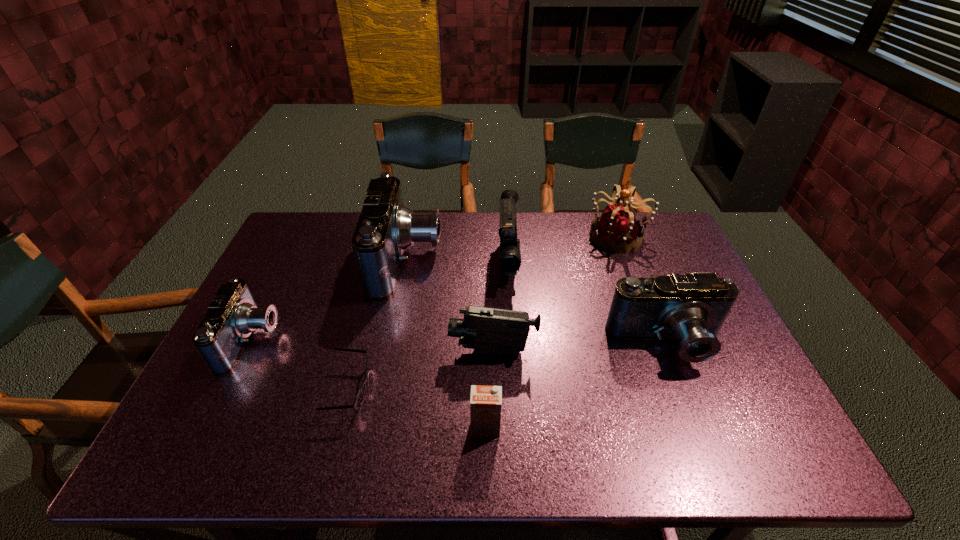
This screenshot has height=540, width=960. I want to click on blue camcorder that is the closest to the bigger black camcorder, so click(385, 228).

Locate an element on the screen. The image size is (960, 540). vacant space that satisfies the following two spatial constraints: 1. on the front-facing side of the bigger black camcorder; 2. on the front-facing side of the black spectacles is located at coordinates (516, 389).

I want to click on vacant space that satisfies the following two spatial constraints: 1. on the front-facing side of the smaller black camcorder; 2. on the front side of the orange orange juice, so click(494, 427).

The width and height of the screenshot is (960, 540). I want to click on blank area in the image that satisfies the following two spatial constraints: 1. on the front-facing side of the tiara; 2. on the front-facing side of the bigger black camcorder, so click(x=628, y=262).